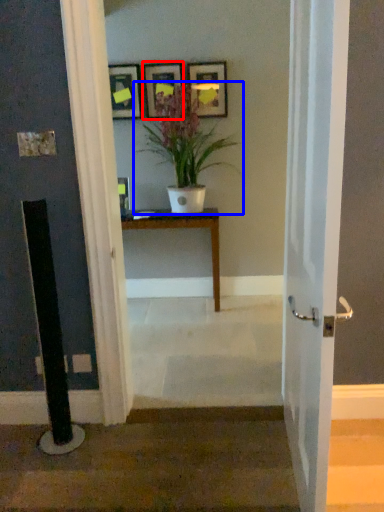
Question: Which object is further to the camera taking this photo, picture frame (highlighted by a red box) or houseplant (highlighted by a blue box)?

Choices:
 (A) picture frame
 (B) houseplant

Answer: (A)